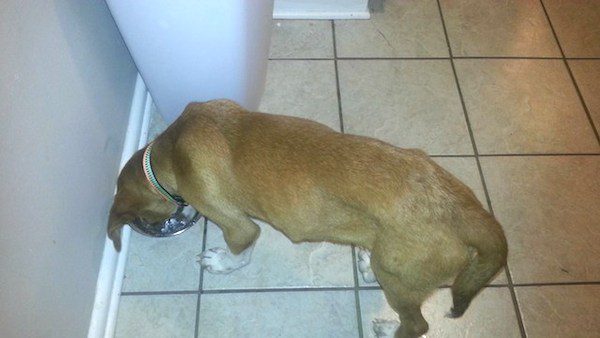
Where is `bathroom sink`? The width and height of the screenshot is (600, 338). bathroom sink is located at coordinates (199, 46).